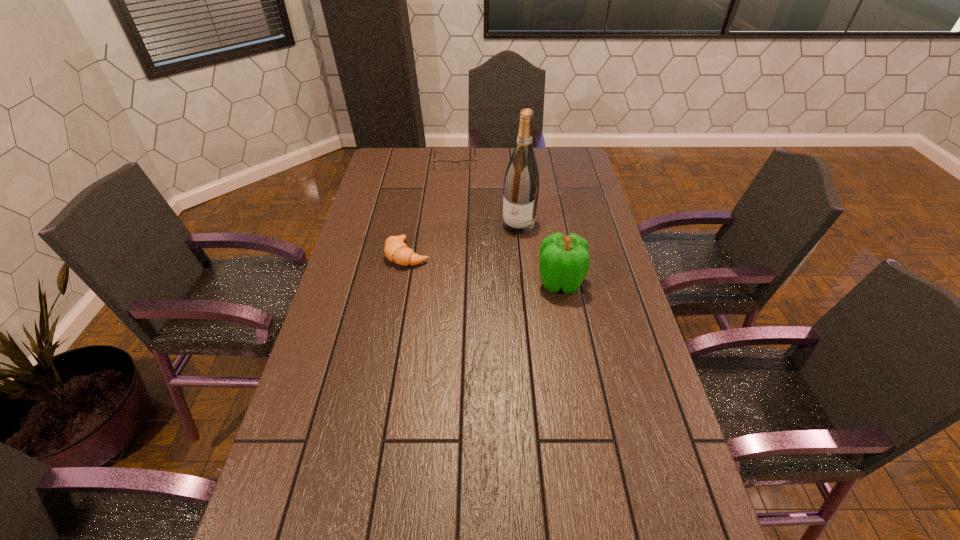
This screenshot has height=540, width=960. I want to click on unoccupied area between the wine bottle and the third shortest object, so click(540, 253).

Find the location of a particular element. the closest object to the spectacles is located at coordinates (521, 183).

Find the location of a particular element. The width and height of the screenshot is (960, 540). object that is the third closest one to the crescent roll is located at coordinates (465, 164).

At what (x,y) coordinates should I click in order to perform the action: click on vacant region that satisfies the following two spatial constraints: 1. on the front side of the third nearest object; 2. on the right side of the bell pepper. Please return your answer as a coordinate pair (x, y). Looking at the image, I should click on (524, 282).

Locate an element on the screen. The height and width of the screenshot is (540, 960). vacant space that satisfies the following two spatial constraints: 1. on the front side of the bell pepper; 2. on the right side of the crescent roll is located at coordinates (403, 282).